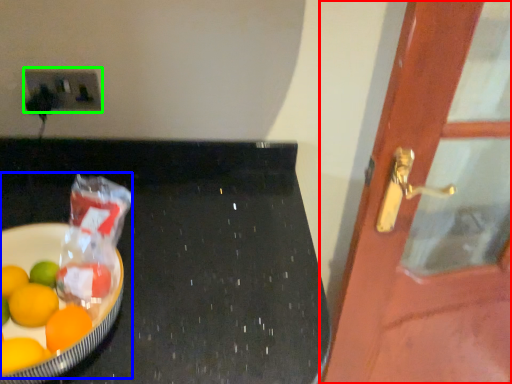
Question: Estimate the real-world distances between objects in this image. Which object is closer to door (highlighted by a red box), fruit dish (highlighted by a blue box) or electric outlet (highlighted by a green box)?

Choices:
 (A) fruit dish
 (B) electric outlet

Answer: (A)